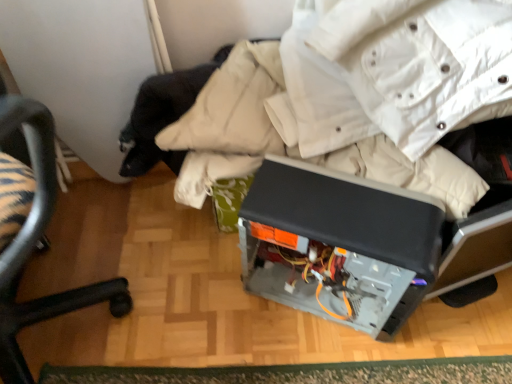
Locate an element on the screen. free space behind green textured mat at lower center is located at coordinates (239, 289).